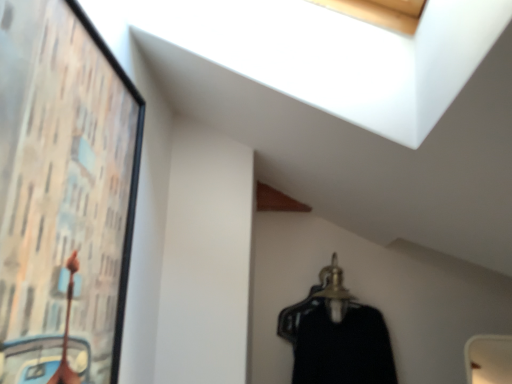
Question: Is gold metallic hanger at lower center in front of black matte dress at center?

Choices:
 (A) yes
 (B) no

Answer: (B)

Question: Considering the relative sizes of gold metallic hanger at lower center and black matte dress at center in the image provided, is gold metallic hanger at lower center taller than black matte dress at center?

Choices:
 (A) yes
 (B) no

Answer: (B)

Question: Is black matte dress at center a part of gold metallic hanger at lower center?

Choices:
 (A) no
 (B) yes

Answer: (A)

Question: Is gold metallic hanger at lower center completely or partially outside of black matte dress at center?

Choices:
 (A) no
 (B) yes

Answer: (B)

Question: From the image's perspective, is gold metallic hanger at lower center on top of black matte dress at center?

Choices:
 (A) yes
 (B) no

Answer: (A)

Question: Considering the relative sizes of gold metallic hanger at lower center and black matte dress at center in the image provided, is gold metallic hanger at lower center smaller than black matte dress at center?

Choices:
 (A) yes
 (B) no

Answer: (A)

Question: From a real-world perspective, is black matte dress at center positioned over wooden framed artwork at left based on gravity?

Choices:
 (A) yes
 (B) no

Answer: (B)

Question: Is black matte dress at center aimed at wooden framed artwork at left?

Choices:
 (A) yes
 (B) no

Answer: (B)

Question: From a real-world perspective, is black matte dress at center under wooden framed artwork at left?

Choices:
 (A) yes
 (B) no

Answer: (A)

Question: Can you see black matte dress at center touching wooden framed artwork at left?

Choices:
 (A) yes
 (B) no

Answer: (B)

Question: Can you confirm if black matte dress at center is wider than wooden framed artwork at left?

Choices:
 (A) yes
 (B) no

Answer: (A)

Question: Is black matte dress at center thinner than wooden framed artwork at left?

Choices:
 (A) no
 (B) yes

Answer: (A)

Question: Is wooden framed artwork at left located outside gold metallic hanger at lower center?

Choices:
 (A) yes
 (B) no

Answer: (A)